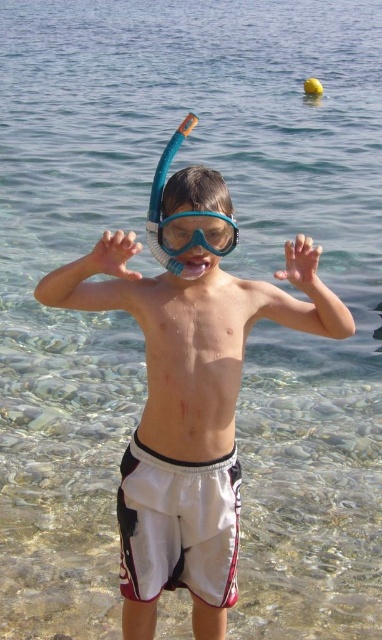
You are a lifeguard on duty at the beach. You notice two points in the water where swimmers might be in trouble. The first point is at coordinates point (147, 436) and the second is at point (302, 285). Based on their positions, which point is closer to the shore?

Point (302, 285) is closer to the shore because it is in front of point (147, 436), which is further away from the shore.

You are a lifeguard who needs to ensure the snorkel fits properly. The blue rubber snorkel at center must be checked against the white matte hand at center. Is the snorkel wider than the hand?

The blue rubber snorkel at center might be wider than white matte hand at center, so there is a possibility that the snorkel is wider than the hand.

The child is holding the snorkel in their hand. Is the blue rubber snorkel at center above or below the white matte hand at center?

The blue rubber snorkel at center is located above the white matte hand at center.